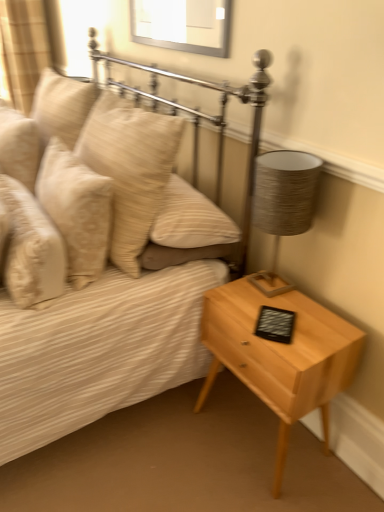
Locate an element on the screen. The width and height of the screenshot is (384, 512). free point above light wood/texture nightstand at lower right (from a real-world perspective) is located at coordinates (275, 309).